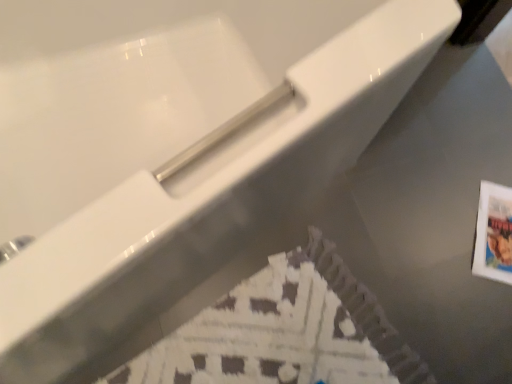
This screenshot has width=512, height=384. Find the location of `free point below printed paper postcard at lower right (from a real-world perspective)`. free point below printed paper postcard at lower right (from a real-world perspective) is located at coordinates (496, 238).